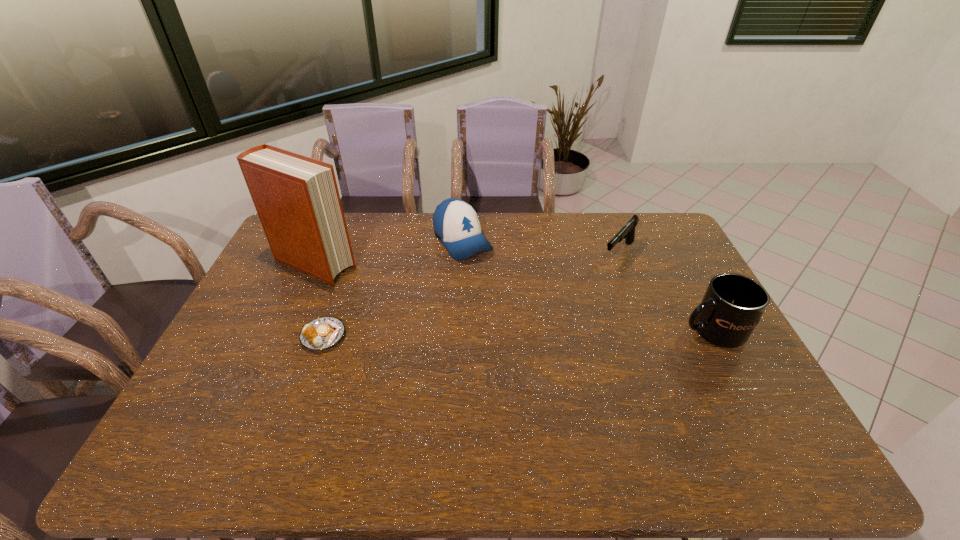
Where is `the third closest object to the pastry`? The image size is (960, 540). the third closest object to the pastry is located at coordinates (627, 232).

Find the location of a particular element. object that is the third closest to the pastry is located at coordinates (627, 232).

Identify the location of free space that satisfies the following two spatial constraints: 1. on the back side of the gun; 2. on the left side of the shortest object. (352, 254).

The image size is (960, 540). In order to click on free space that satisfies the following two spatial constraints: 1. on the back side of the shortest object; 2. with the handle on the side of the rightmost object in this screenshot , I will do `click(325, 331)`.

The width and height of the screenshot is (960, 540). I want to click on vacant space that satisfies the following two spatial constraints: 1. on the front side of the tallest object; 2. on the left side of the shortest object, so click(x=282, y=336).

The width and height of the screenshot is (960, 540). What are the coordinates of `vacant space that satisfies the following two spatial constraints: 1. on the back side of the baseball cap; 2. on the right side of the pastry` in the screenshot? It's located at (357, 241).